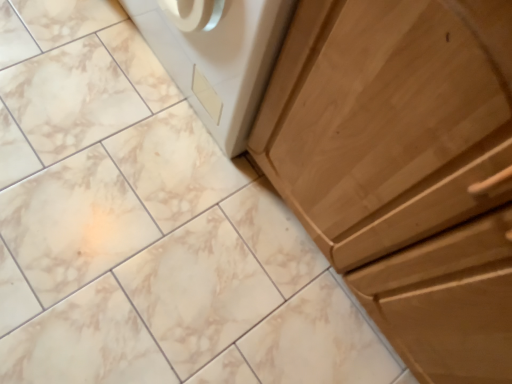
What are the coordinates of `wooden cabinet at right` in the screenshot? It's located at (403, 168).

Image resolution: width=512 pixels, height=384 pixels. Describe the element at coordinates (403, 168) in the screenshot. I see `wooden cabinet at right` at that location.

I want to click on white glossy washing machine at upper center, so click(x=216, y=56).

The image size is (512, 384). Describe the element at coordinates (216, 56) in the screenshot. I see `white glossy washing machine at upper center` at that location.

Locate an element on the screen. The image size is (512, 384). wooden cabinet at right is located at coordinates (403, 168).

Considering the relative positions of wooden cabinet at right and white glossy washing machine at upper center in the image provided, is wooden cabinet at right to the left or to the right of white glossy washing machine at upper center?

Based on their positions, wooden cabinet at right is located to the right of white glossy washing machine at upper center.

Which object is further away from the camera taking this photo, wooden cabinet at right or white glossy washing machine at upper center?

white glossy washing machine at upper center.

Is point (487, 142) less distant than point (266, 69)?

Yes.

From the image's perspective, is wooden cabinet at right on white glossy washing machine at upper center?

No, from the image's perspective, wooden cabinet at right is not on top of white glossy washing machine at upper center.

From a real-world perspective, is wooden cabinet at right under white glossy washing machine at upper center?

No, from a real-world perspective, wooden cabinet at right is not under white glossy washing machine at upper center.

Which object is wider, wooden cabinet at right or white glossy washing machine at upper center?

With larger width is wooden cabinet at right.

From their relative heights in the image, would you say wooden cabinet at right is taller or shorter than white glossy washing machine at upper center?

Considering their sizes, wooden cabinet at right has more height than white glossy washing machine at upper center.

Consider the image. Considering the relative sizes of wooden cabinet at right and white glossy washing machine at upper center in the image provided, is wooden cabinet at right smaller than white glossy washing machine at upper center?

No.

Is white glossy washing machine at upper center inside wooden cabinet at right?

No, white glossy washing machine at upper center is located outside of wooden cabinet at right.

Are wooden cabinet at right and white glossy washing machine at upper center located far from each other?

No.

Is wooden cabinet at right oriented towards white glossy washing machine at upper center?

No, wooden cabinet at right is not turned towards white glossy washing machine at upper center.

Locate an element on the screen. home appliance above the wooden cabinet at right (from the image's perspective) is located at coordinates (216, 56).

Which is more to the left, white glossy washing machine at upper center or wooden cabinet at right?

white glossy washing machine at upper center is more to the left.

Does white glossy washing machine at upper center lie in front of wooden cabinet at right?

That is False.

Does point (224, 16) appear closer or farther from the camera than point (428, 145)?

Point (224, 16) is farther from the camera than point (428, 145).

From the image's perspective, which object appears higher, white glossy washing machine at upper center or wooden cabinet at right?

white glossy washing machine at upper center is shown above in the image.

From a real-world perspective, is white glossy washing machine at upper center located beneath wooden cabinet at right?

Indeed, from a real-world perspective, white glossy washing machine at upper center is positioned beneath wooden cabinet at right.

Which of these two, white glossy washing machine at upper center or wooden cabinet at right, is thinner?

Thinner between the two is white glossy washing machine at upper center.

Who is shorter, white glossy washing machine at upper center or wooden cabinet at right?

white glossy washing machine at upper center.

From the picture: Does white glossy washing machine at upper center have a smaller size compared to wooden cabinet at right?

Correct, white glossy washing machine at upper center occupies less space than wooden cabinet at right.

Is white glossy washing machine at upper center inside the boundaries of wooden cabinet at right, or outside?

white glossy washing machine at upper center exists outside the volume of wooden cabinet at right.

Is white glossy washing machine at upper center touching wooden cabinet at right?

There is a gap between white glossy washing machine at upper center and wooden cabinet at right.

Is white glossy washing machine at upper center turned away from wooden cabinet at right?

No, wooden cabinet at right is not at the back of white glossy washing machine at upper center.

Image resolution: width=512 pixels, height=384 pixels. Identify the location of cabinetry below the white glossy washing machine at upper center (from the image's perspective). (403, 168).

Find the location of `home appliance behind the wooden cabinet at right`. home appliance behind the wooden cabinet at right is located at coordinates (216, 56).

This screenshot has height=384, width=512. Find the location of `home appliance that appears above the wooden cabinet at right (from the image's perspective)`. home appliance that appears above the wooden cabinet at right (from the image's perspective) is located at coordinates (216, 56).